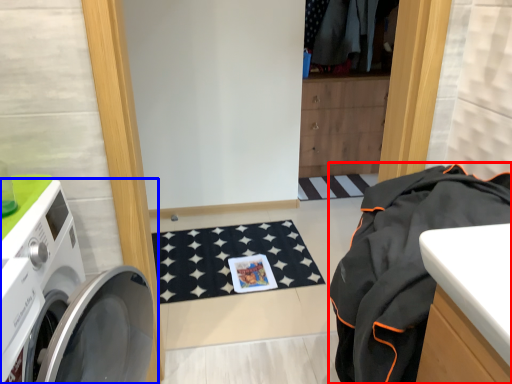
Question: Which object appears closest to the camera in this image, clothing (highlighted by a red box) or washing machine (highlighted by a blue box)?

Choices:
 (A) clothing
 (B) washing machine

Answer: (B)